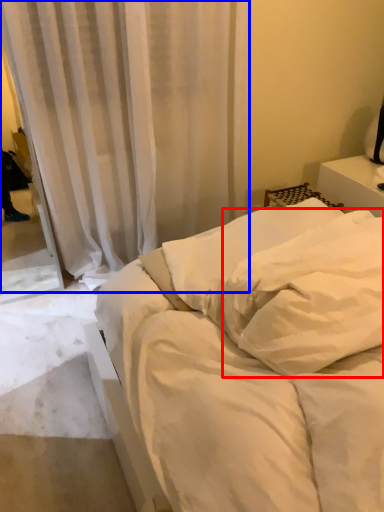
Question: Which object appears farthest to the camera in this image, pillow (highlighted by a red box) or curtain (highlighted by a blue box)?

Choices:
 (A) pillow
 (B) curtain

Answer: (B)